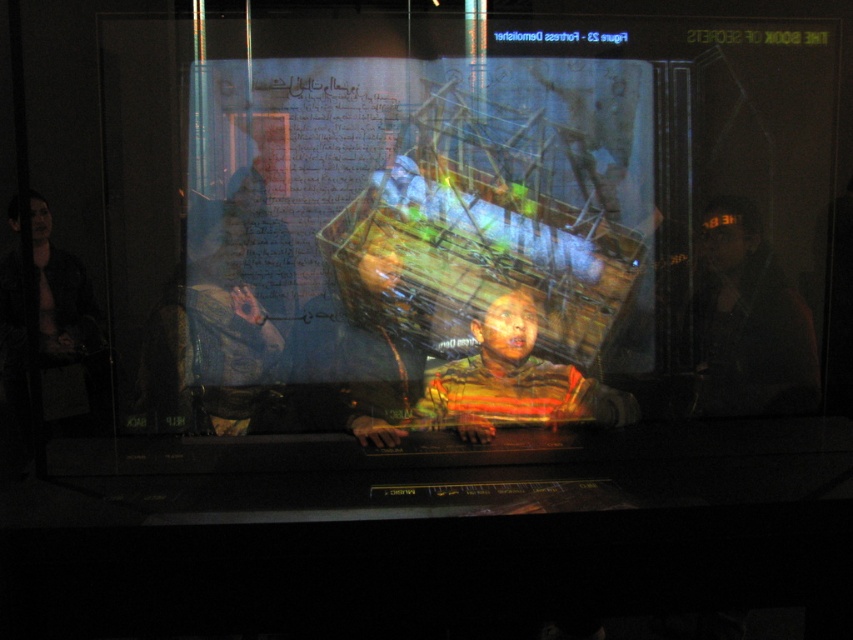
Question: Is matte blue shirt at center above dark hair at right?

Choices:
 (A) no
 (B) yes

Answer: (A)

Question: Is matte blue shirt at center closer to camera compared to dark brown leather jacket at left?

Choices:
 (A) no
 (B) yes

Answer: (B)

Question: Considering the real-world distances, which object is farthest from the dark hair at right?

Choices:
 (A) striped fabric child at center
 (B) dark brown leather jacket at left

Answer: (B)

Question: Which object is the closest to the dark brown leather jacket at left?

Choices:
 (A) striped fabric child at center
 (B) dark hair at right
 (C) matte blue shirt at center

Answer: (C)

Question: Is the position of dark hair at right less distant than that of striped fabric child at center?

Choices:
 (A) no
 (B) yes

Answer: (A)

Question: Which object appears farthest from the camera in this image?

Choices:
 (A) matte blue shirt at center
 (B) striped fabric child at center
 (C) dark brown leather jacket at left

Answer: (C)